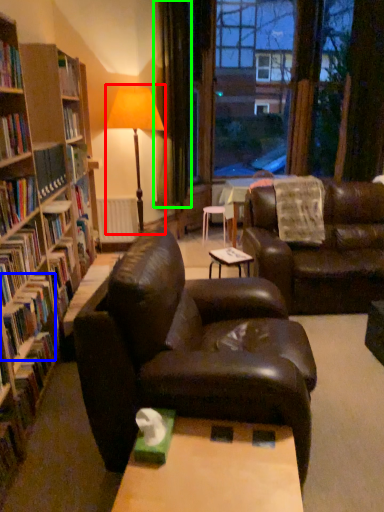
Question: Based on their relative distances, which object is farther from table lamp (highlighted by a red box)? Choose from book (highlighted by a blue box) and curtain (highlighted by a green box).

Choices:
 (A) book
 (B) curtain

Answer: (A)